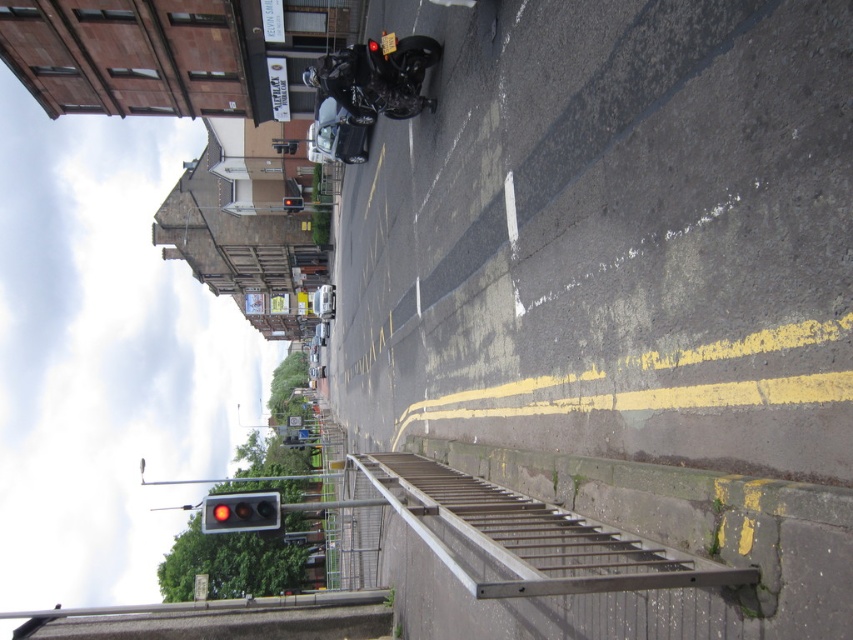
Between red glass traffic light at lower left and red glass traffic light at center, which one has less height?

red glass traffic light at center

Image resolution: width=853 pixels, height=640 pixels. What do you see at coordinates (241, 513) in the screenshot? I see `red glass traffic light at lower left` at bounding box center [241, 513].

This screenshot has height=640, width=853. In order to click on red glass traffic light at lower left in this screenshot , I will do `click(241, 513)`.